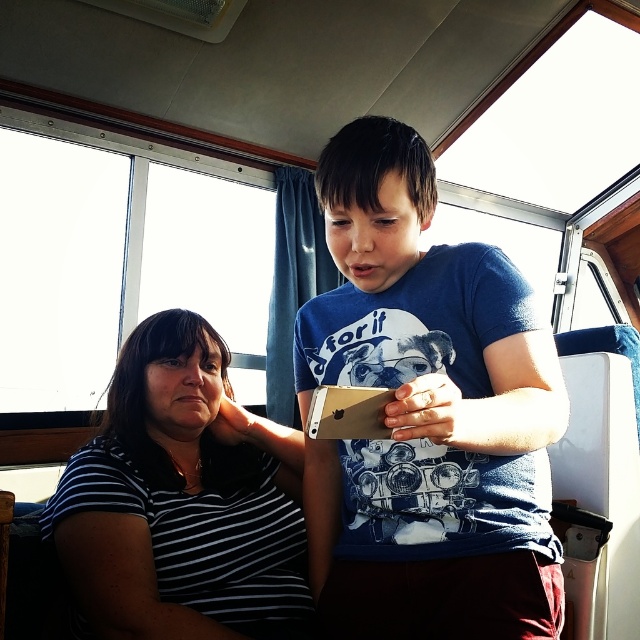
Is blue cotton shirt at center shorter than black striped shirt at left?

No, blue cotton shirt at center is not shorter than black striped shirt at left.

The width and height of the screenshot is (640, 640). In order to click on blue cotton shirt at center in this screenshot , I will do `click(426, 416)`.